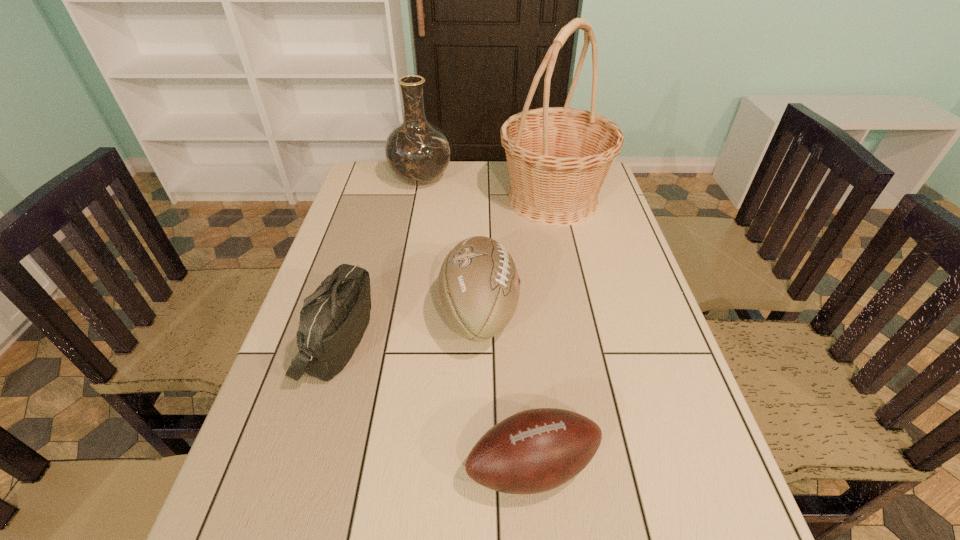
Where is `free space located 0.080m on the back of the nearer football (American)`? This screenshot has width=960, height=540. free space located 0.080m on the back of the nearer football (American) is located at coordinates (526, 396).

Where is `basket that is at the far edge`? This screenshot has width=960, height=540. basket that is at the far edge is located at coordinates (558, 157).

You are a GUI agent. You are given a task and a screenshot of the screen. Output one action in this format:
    pyautogui.click(x=<x>, y=<y>)
    Task: Click on the vase that is at the far edge
    This screenshot has width=960, height=540.
    Given the screenshot: What is the action you would take?
    pyautogui.click(x=417, y=151)

Where is `vase located in the left edge section of the desktop`? The width and height of the screenshot is (960, 540). vase located in the left edge section of the desktop is located at coordinates tap(417, 151).

This screenshot has width=960, height=540. Find the location of `shoulder bag present at the left edge`. shoulder bag present at the left edge is located at coordinates (333, 320).

Where is `object at the right edge`? object at the right edge is located at coordinates (558, 157).

Locate an element on the screen. object that is at the far left corner is located at coordinates (417, 151).

I want to click on object at the far right corner, so click(558, 157).

This screenshot has height=540, width=960. In order to click on free region at the far edge of the desktop in this screenshot , I will do `click(459, 168)`.

Locate an element on the screen. This screenshot has height=540, width=960. free space at the left edge is located at coordinates (228, 517).